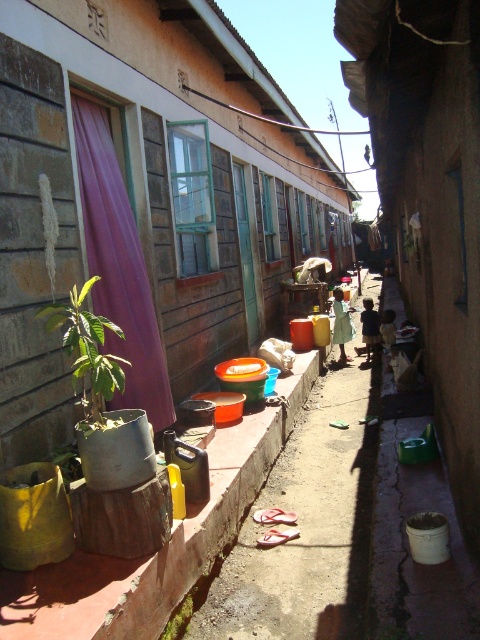
Question: Is purple fabric curtain at left behind green matte plant at left?

Choices:
 (A) no
 (B) yes

Answer: (B)

Question: Which point is closer to the camera taking this photo?

Choices:
 (A) (115, 220)
 (B) (81, 301)
 (C) (186, 595)

Answer: (B)

Question: Can you confirm if purple fabric curtain at left is positioned above green leafy plant at lower center?

Choices:
 (A) no
 (B) yes

Answer: (B)

Question: Considering the real-world distances, which object is farthest from the purple fabric curtain at left?

Choices:
 (A) green leafy plant at lower center
 (B) green matte plant at left

Answer: (A)

Question: Which object is positioned farthest from the purple fabric curtain at left?

Choices:
 (A) green leafy plant at lower center
 (B) green matte plant at left

Answer: (A)

Question: Does purple fabric curtain at left appear on the right side of green leafy plant at lower center?

Choices:
 (A) yes
 (B) no

Answer: (B)